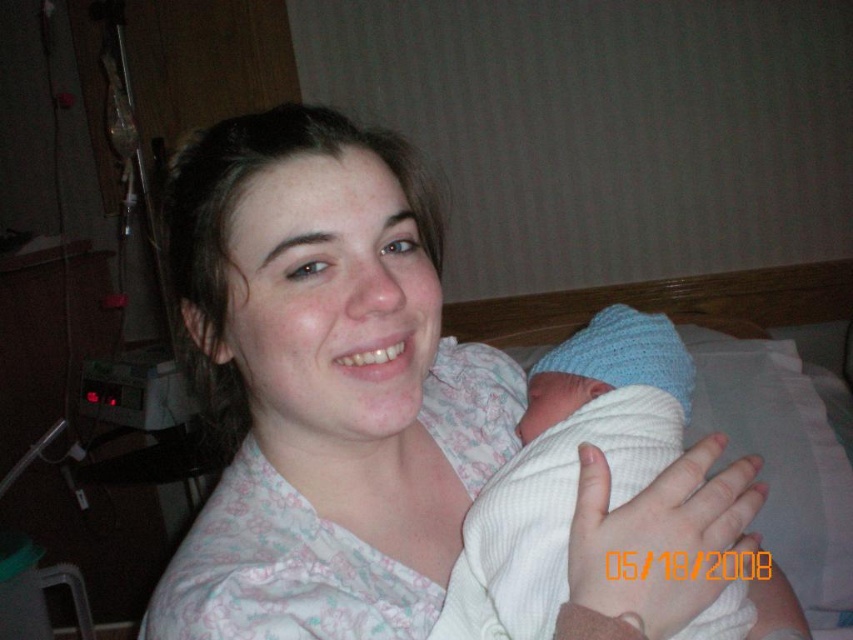
Question: Which object appears closest to the camera in this image?

Choices:
 (A) white knit hat at upper right
 (B) white cotton shirt at center

Answer: (B)

Question: From the image, what is the correct spatial relationship of white cotton shirt at center in relation to white knit hat at upper right?

Choices:
 (A) left
 (B) right

Answer: (A)

Question: Among these points, which one is nearest to the camera?

Choices:
 (A) (633, 369)
 (B) (368, 580)

Answer: (B)

Question: Is white cotton shirt at center to the left of white knit hat at upper right from the viewer's perspective?

Choices:
 (A) no
 (B) yes

Answer: (B)

Question: Does white cotton shirt at center appear on the left side of white knit hat at upper right?

Choices:
 (A) no
 (B) yes

Answer: (B)